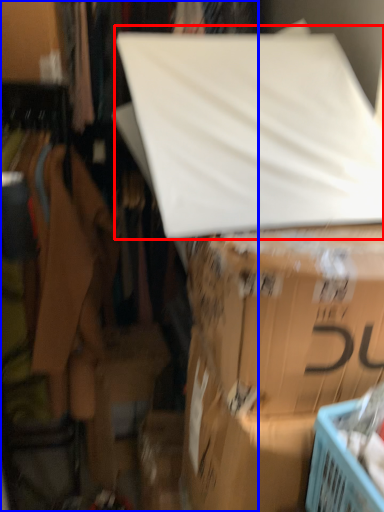
Question: Which object appears farthest to the camera in this image, linen (highlighted by a red box) or closet (highlighted by a blue box)?

Choices:
 (A) linen
 (B) closet

Answer: (B)